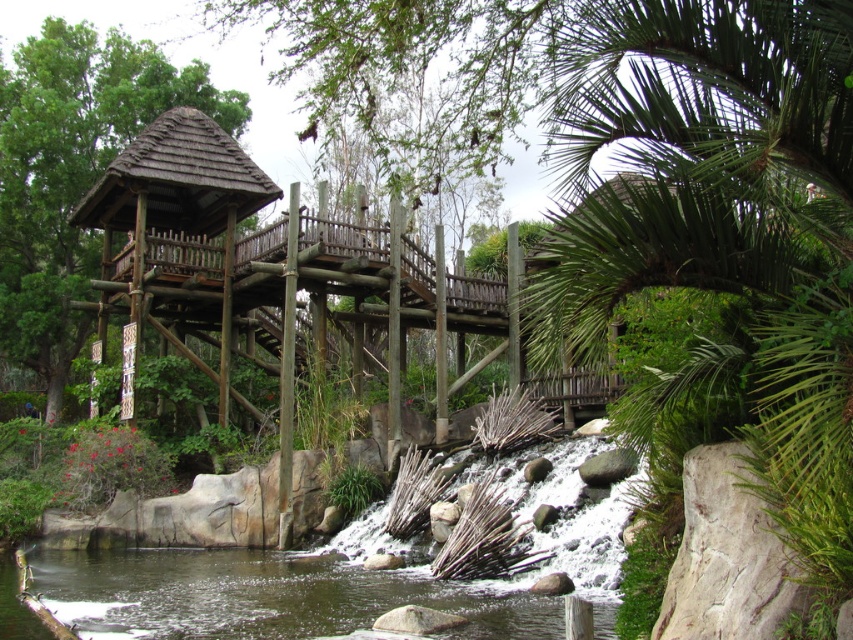
Can you confirm if brown wooden gazebo at upper left is wider than greenish-brown water at lower center?

Correct, the width of brown wooden gazebo at upper left exceeds that of greenish-brown water at lower center.

The width and height of the screenshot is (853, 640). Describe the element at coordinates (73, 172) in the screenshot. I see `brown wooden gazebo at upper left` at that location.

Identify the location of brown wooden gazebo at upper left. The image size is (853, 640). (73, 172).

Is point (74, 252) positioned before point (241, 204)?

No, it is not.

Locate an element on the screen. The height and width of the screenshot is (640, 853). brown wooden gazebo at upper left is located at coordinates (73, 172).

Who is higher up, greenish-brown water at lower center or wooden thatched roof gazebo at left?

wooden thatched roof gazebo at left is higher up.

Is point (108, 602) positioned before point (212, 211)?

Yes, it is.

Find the location of a particular element. The image size is (853, 640). greenish-brown water at lower center is located at coordinates (263, 596).

This screenshot has height=640, width=853. What are the coordinates of `greenish-brown water at lower center` in the screenshot? It's located at (263, 596).